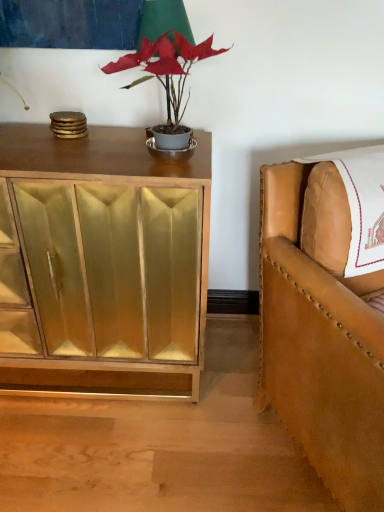
The width and height of the screenshot is (384, 512). I want to click on free spot in front of gold mirrored cabinet at left, so click(x=88, y=451).